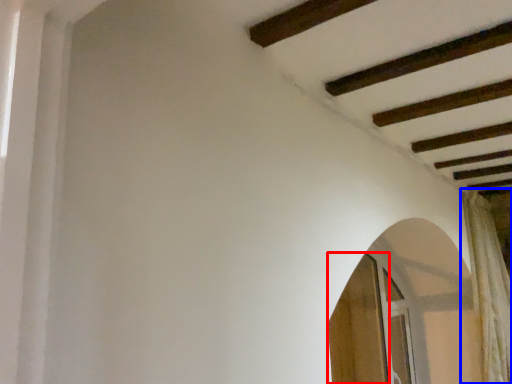
Question: Which object is closer to the camera taking this photo, screen door (highlighted by a red box) or curtain (highlighted by a blue box)?

Choices:
 (A) screen door
 (B) curtain

Answer: (A)